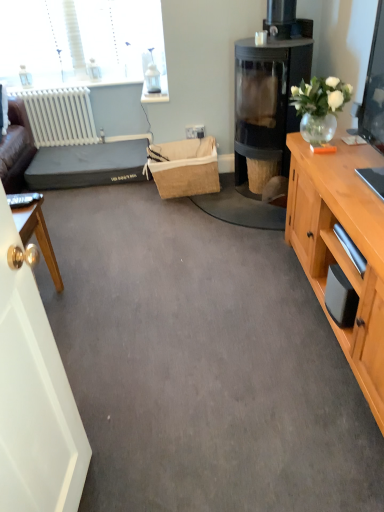
I want to click on vacant area that lies to the right of white glossy door at left, so click(137, 474).